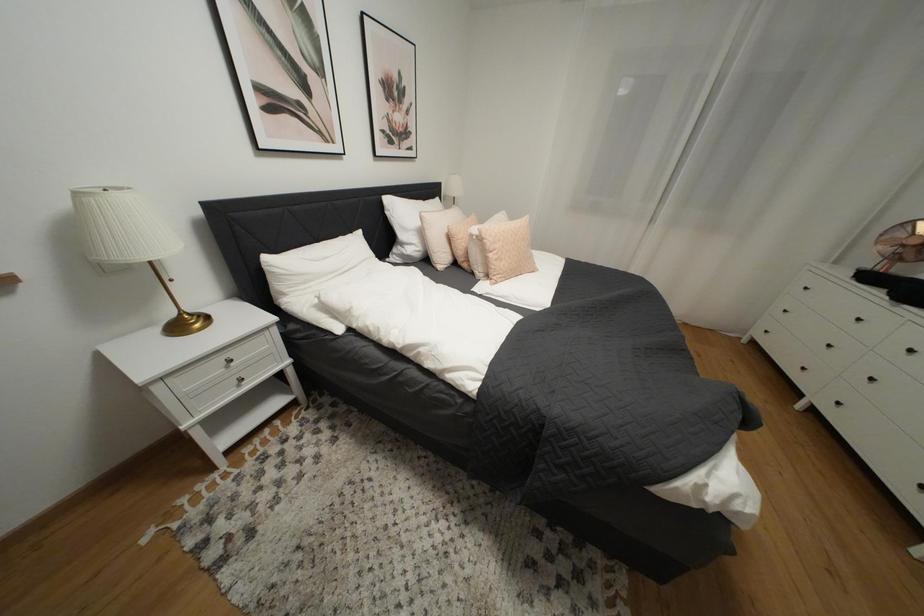
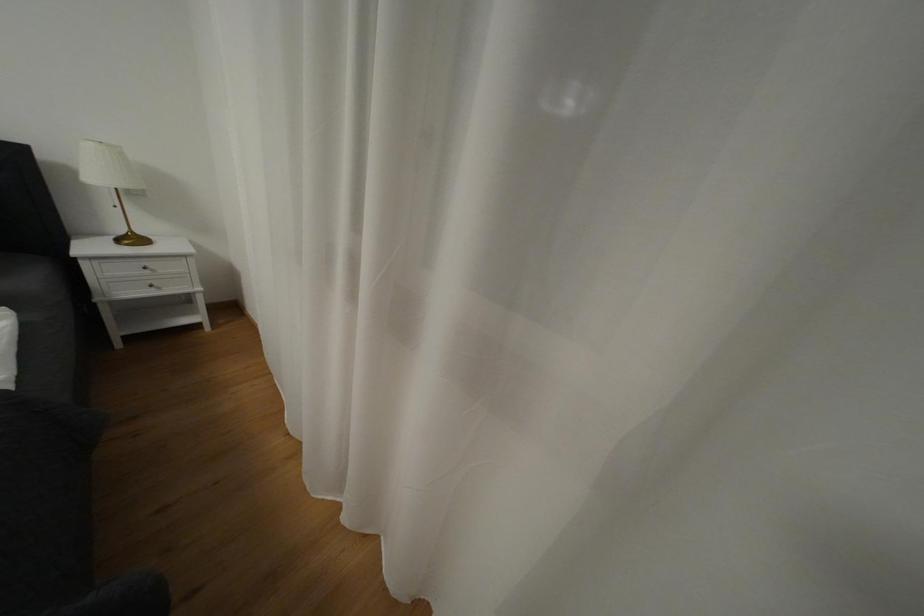
Which direction would the cameraman need to move to produce the second image?

The movement direction of the cameraman is right, forward.